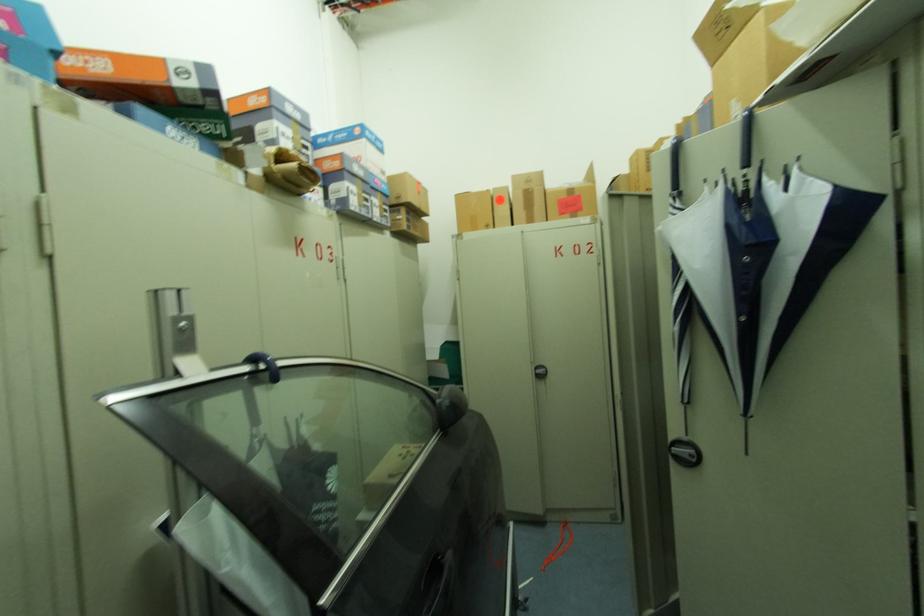
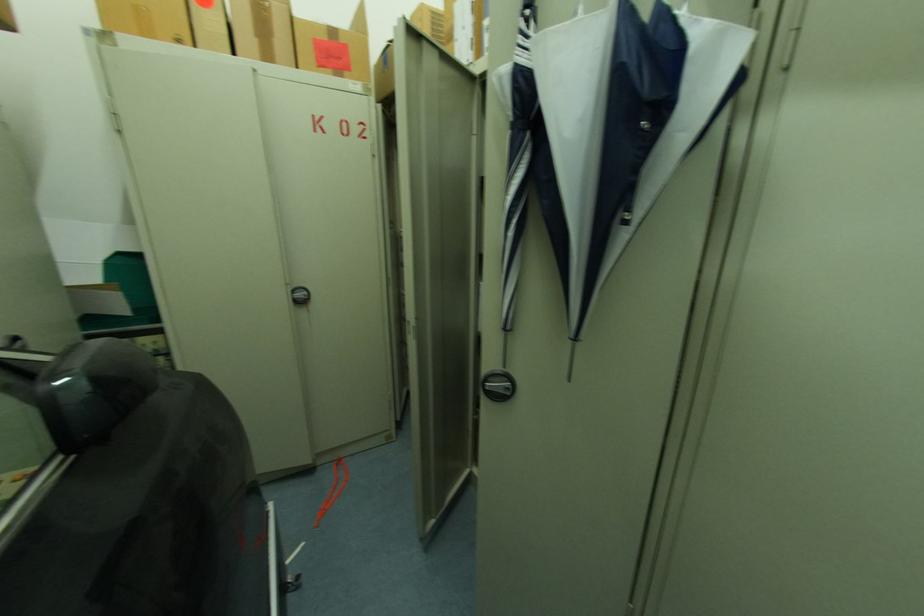
Question: The camera is either moving clockwise (left) or counter-clockwise (right) around the object. The first image is from the beginning of the video and the second image is from the end. Is the camera moving left or right when shooting the video?

Choices:
 (A) Left
 (B) Right

Answer: (A)